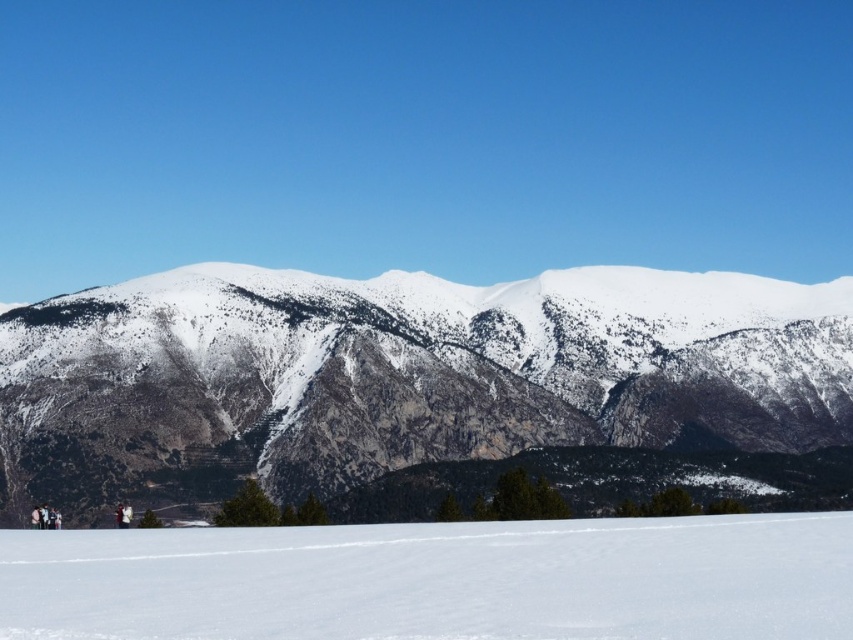
Which of these two, white rocky mountain at center or white snow ski slope at lower center, stands taller?

Standing taller between the two is white rocky mountain at center.

Can you confirm if white rocky mountain at center is taller than white snow ski slope at lower center?

Yes.

Identify the location of white rocky mountain at center. (410, 371).

Identify the location of white rocky mountain at center. This screenshot has height=640, width=853. (410, 371).